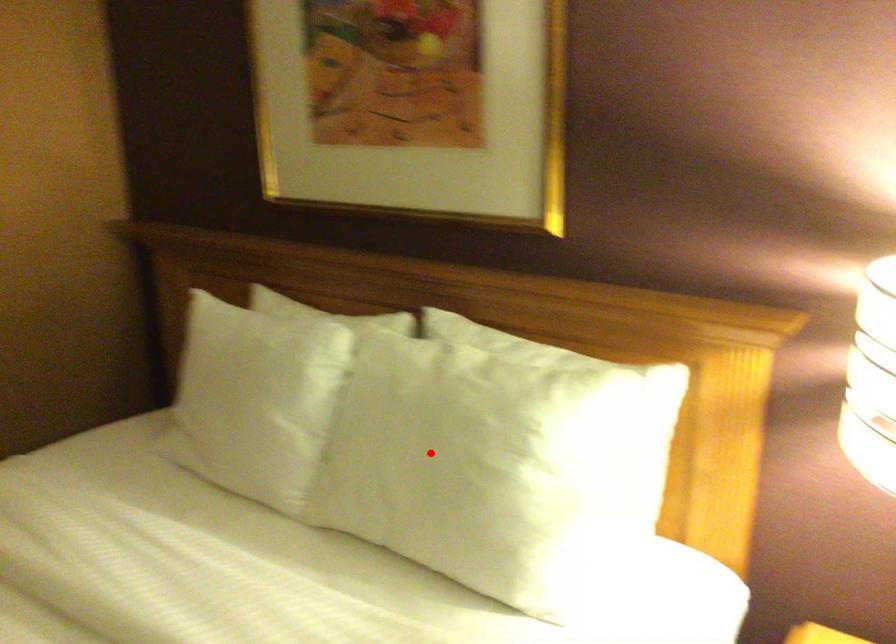
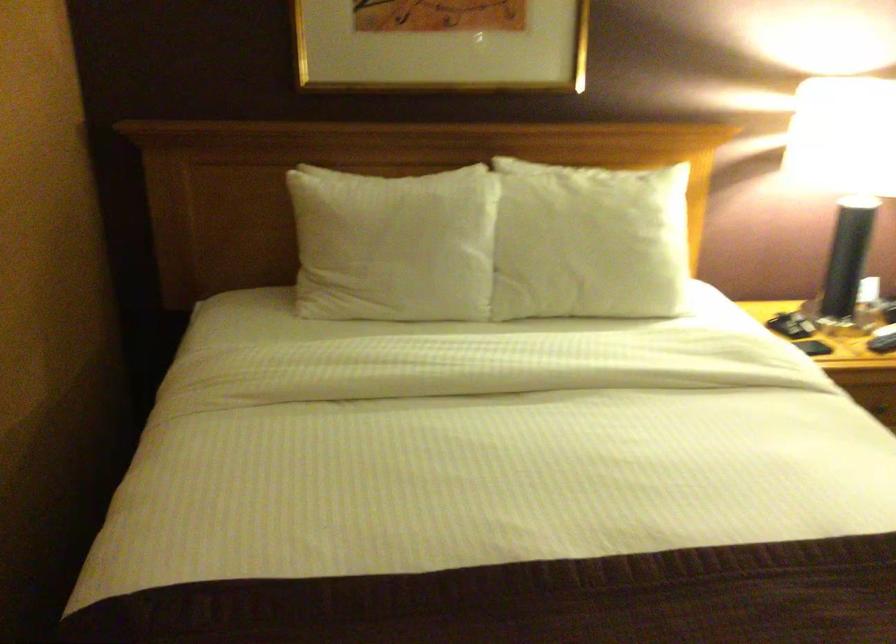
The point at the highlighted location is marked in the first image. Where is the corresponding point in the second image?

(589, 242)